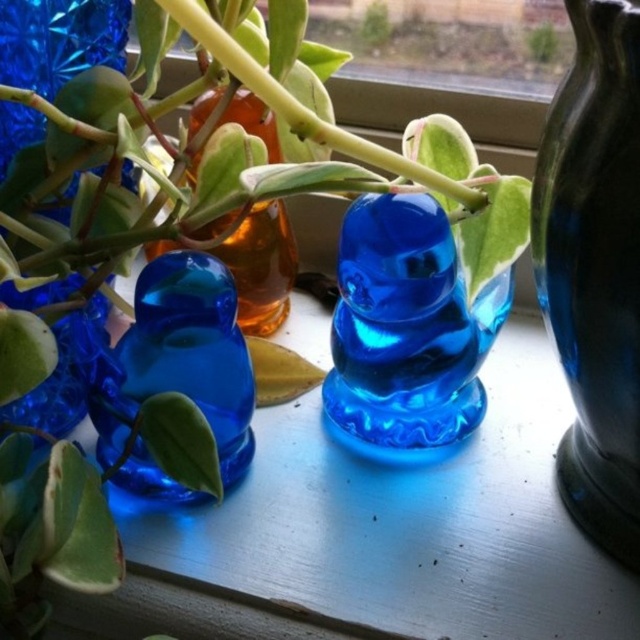
Is point (472, 406) in front of point (20, 54)?

No, (472, 406) is behind (20, 54).

Is transparent blue glass duck at center positioned before transparent blue glass at left?

No, transparent blue glass duck at center is behind transparent blue glass at left.

Where is `transparent blue glass duck at center`? transparent blue glass duck at center is located at coordinates (406, 328).

Can you confirm if transparent glass duck at left is positioned above transparent blue glass at left?

Actually, transparent glass duck at left is below transparent blue glass at left.

Can you confirm if transparent glass duck at left is taller than transparent blue glass at left?

No.

The image size is (640, 640). Describe the element at coordinates (176, 358) in the screenshot. I see `transparent glass duck at left` at that location.

Image resolution: width=640 pixels, height=640 pixels. I want to click on transparent glass duck at left, so click(x=176, y=358).

Between matte black vase at right and transparent blue glass duck at center, which one has more height?

Standing taller between the two is matte black vase at right.

Does matte black vase at right lie behind transparent blue glass duck at center?

That is False.

Who is more distant from viewer, [600,200] or [509,282]?

Point [509,282]

At what (x,y) coordinates should I click in order to perform the action: click on matte black vase at right. Please return your answer as a coordinate pair (x, y). Looking at the image, I should click on (595, 268).